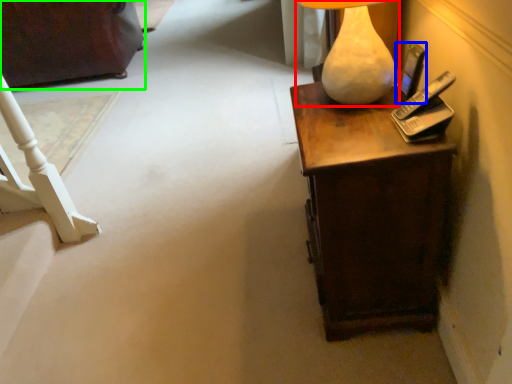
Question: Estimate the real-world distances between objects in this image. Which object is farther from lamp (highlighted by a red box), mobile phone (highlighted by a blue box) or furniture (highlighted by a green box)?

Choices:
 (A) mobile phone
 (B) furniture

Answer: (B)